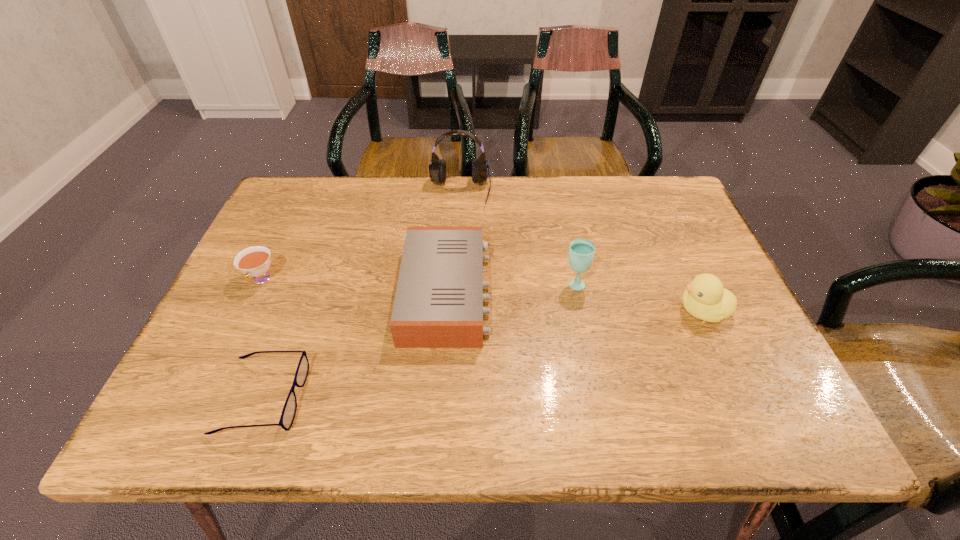
Where is `vacant space that is in between the teacup and the radio receiver`? vacant space that is in between the teacup and the radio receiver is located at coordinates (354, 287).

At what (x,y) coordinates should I click in order to perform the action: click on vacant area that lies between the radio receiver and the glass. Please return your answer as a coordinate pair (x, y). Looking at the image, I should click on (511, 288).

What are the coordinates of `blank region between the radio receiver and the glass` in the screenshot? It's located at (511, 288).

At what (x,y) coordinates should I click in order to perform the action: click on vacant area that lies between the fourth shortest object and the spectacles. Please return your answer as a coordinate pair (x, y). The height and width of the screenshot is (540, 960). Looking at the image, I should click on (483, 354).

Locate an element on the screen. This screenshot has height=540, width=960. free space between the nearest object and the teacup is located at coordinates (262, 338).

Locate an element on the screen. object that is the fifth closest one to the nearest object is located at coordinates [705, 298].

Identify which object is the third closest to the nearest object. Please provide its 2D coordinates. Your answer should be formatted as a tuple, i.e. [(x, y)], where the tuple contains the x and y coordinates of a point satisfying the conditions above.

[(437, 169)]

I want to click on free spot that satisfies the following two spatial constraints: 1. on the ear cushions of the tallest object; 2. on the control panel of the radio receiver, so click(x=454, y=293).

Where is `free location that satisfies the following two spatial constraints: 1. on the ear cushions of the glass; 2. on the right side of the headset`? free location that satisfies the following two spatial constraints: 1. on the ear cushions of the glass; 2. on the right side of the headset is located at coordinates (455, 284).

This screenshot has width=960, height=540. I want to click on vacant region that satisfies the following two spatial constraints: 1. on the side of the teacup with the handle; 2. on the left side of the fifth object from left to right, so click(x=260, y=284).